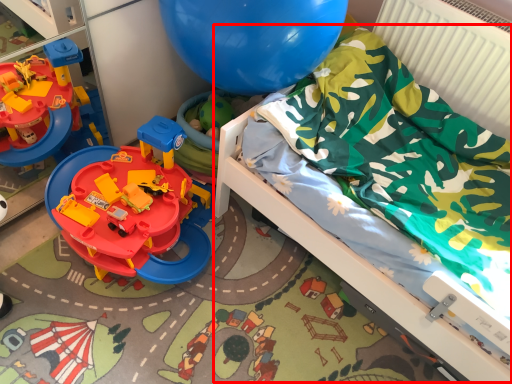
Question: Observing the image, what is the correct spatial positioning of bed (annotated by the red box) in reference to radiator?

Choices:
 (A) left
 (B) right

Answer: (A)